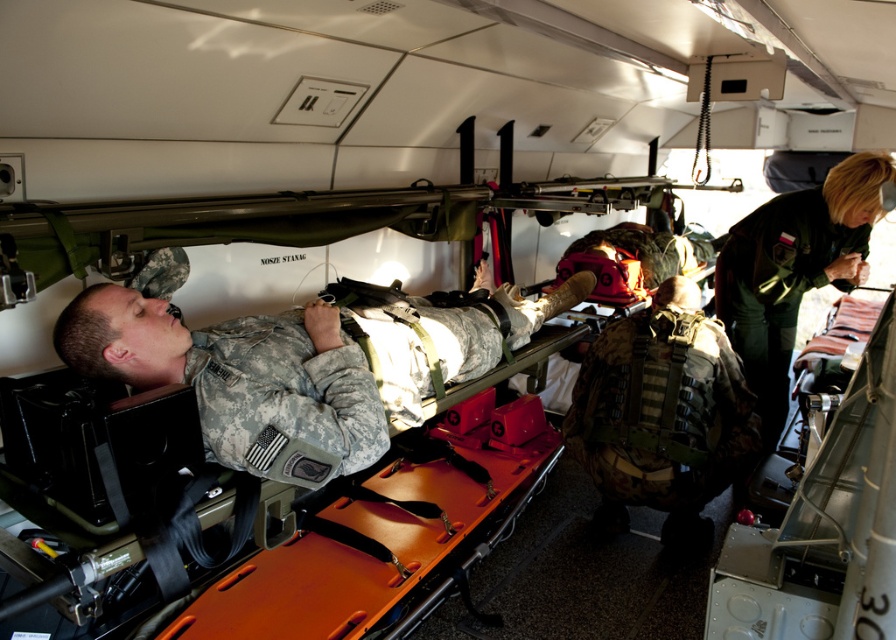
Is camo fabric vest at center thinner than green uniform at center?

Incorrect, camo fabric vest at center's width is not less than green uniform at center's.

Between camo fabric vest at center and green uniform at center, which one appears on the right side from the viewer's perspective?

From the viewer's perspective, green uniform at center appears more on the right side.

In the scene shown: Who is more distant from viewer, (619,328) or (781,243)?

Point (781,243)

Where is `camo fabric vest at center`? The width and height of the screenshot is (896, 640). camo fabric vest at center is located at coordinates (662, 417).

Is camouflage fabric soldier at center to the left of camo fabric vest at center from the viewer's perspective?

Indeed, camouflage fabric soldier at center is positioned on the left side of camo fabric vest at center.

Based on the photo, which is more to the right, camouflage fabric soldier at center or camo fabric vest at center?

camo fabric vest at center

You are a GUI agent. You are given a task and a screenshot of the screen. Output one action in this format:
    pyautogui.click(x=<x>, y=<y>)
    Task: Click on the camouflage fabric soldier at center
    
    Given the screenshot: What is the action you would take?
    pyautogui.click(x=259, y=378)

Does camouflage fabric soldier at center lie in front of green uniform at center?

Yes, it is.

Is point (359, 352) farther from camera compared to point (716, 300)?

That is False.

Identify the location of camouflage fabric soldier at center. The width and height of the screenshot is (896, 640). (259, 378).